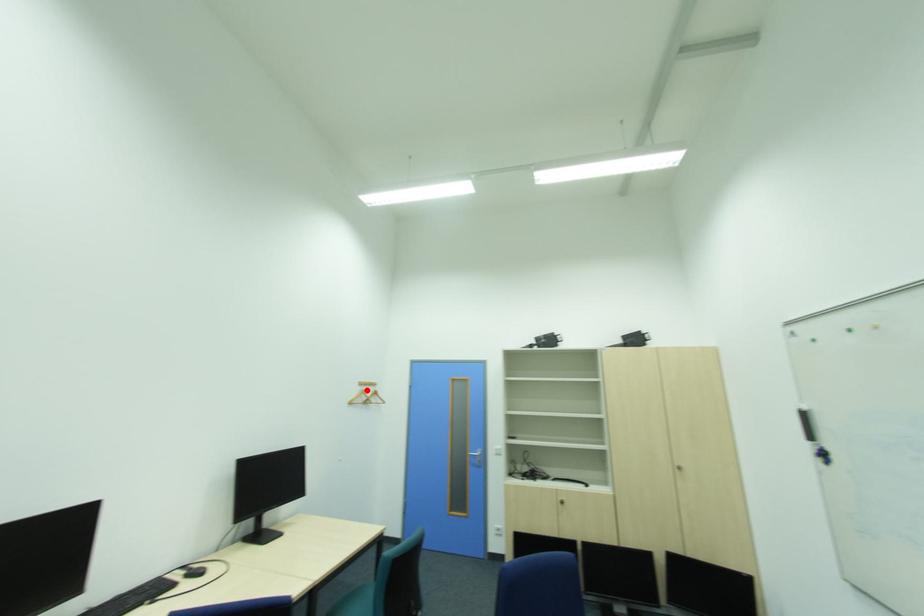
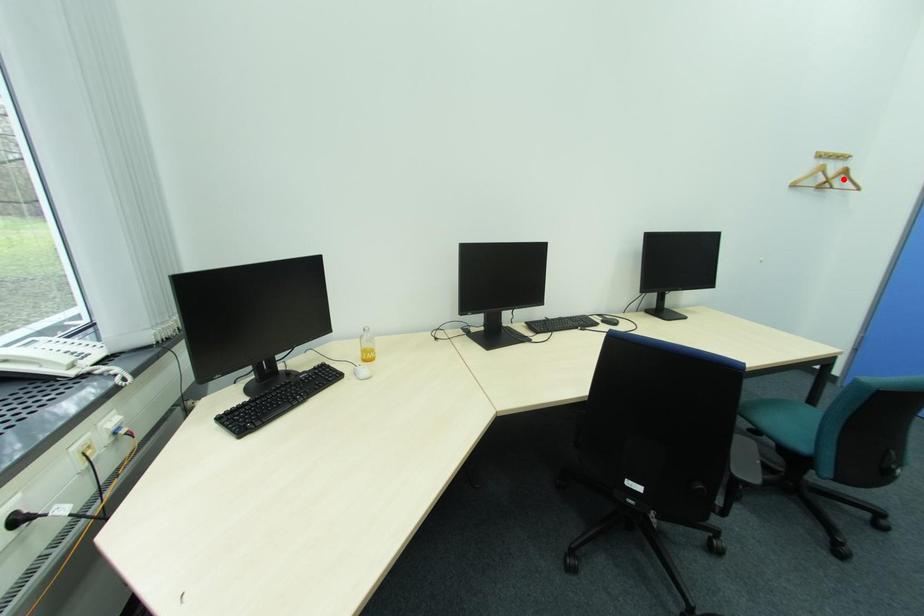
I am providing you with two images of the same scene from different viewpoints. A red point is marked on the first image and another point is marked on the second image. Do the highlighted points in image1 and image2 indicate the same real-world spot?

No